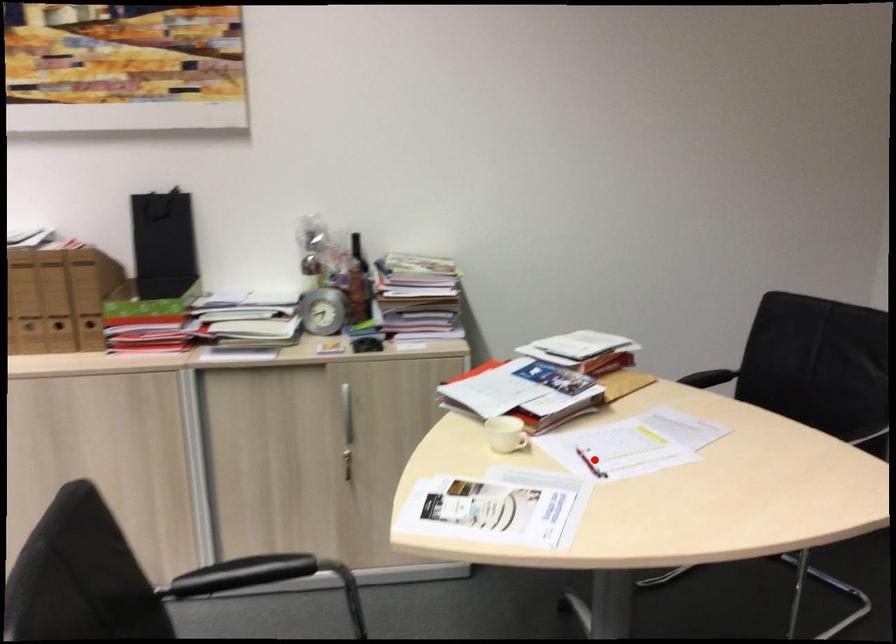
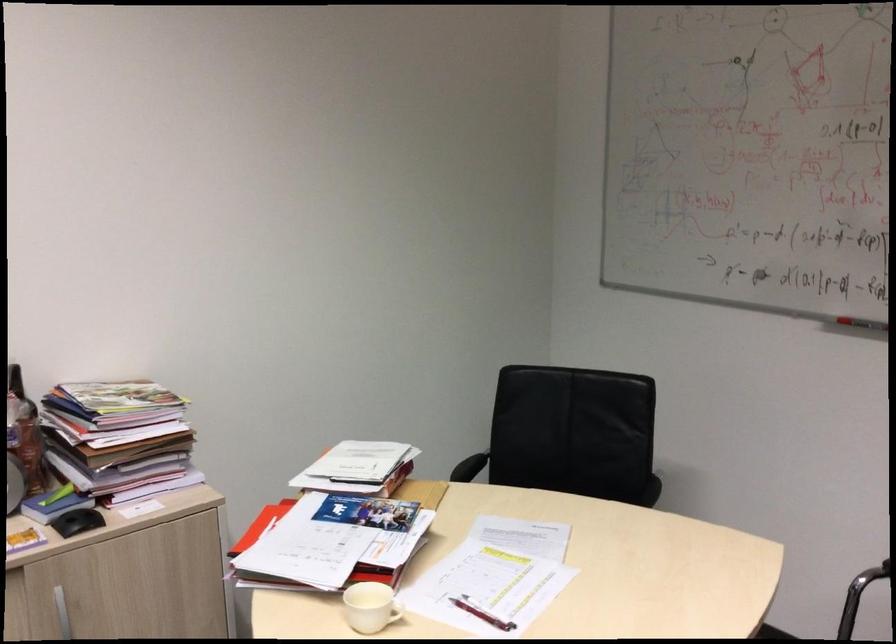
Where in the second image is the point corresponding to the highlighted location from the first image?

(481, 612)